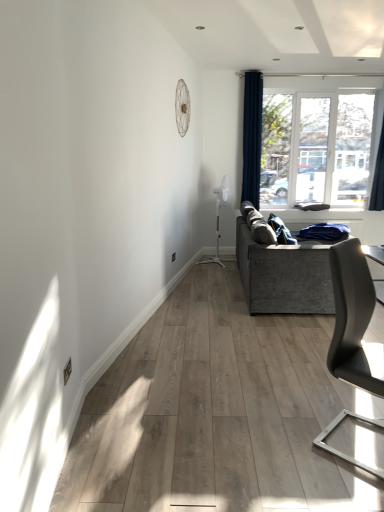
Find the location of a particular element. The width and height of the screenshot is (384, 512). vacant space behind matte gray chair at right is located at coordinates (321, 394).